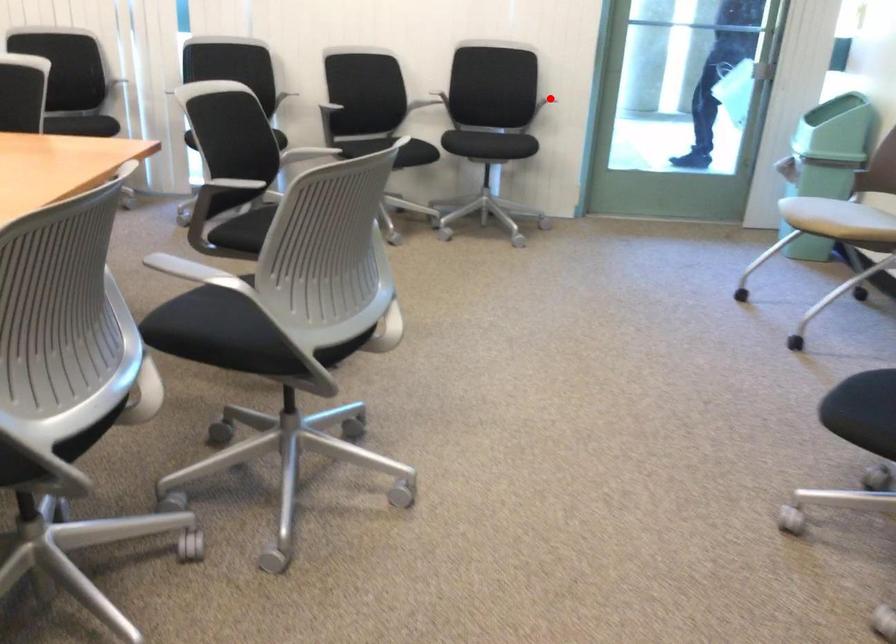
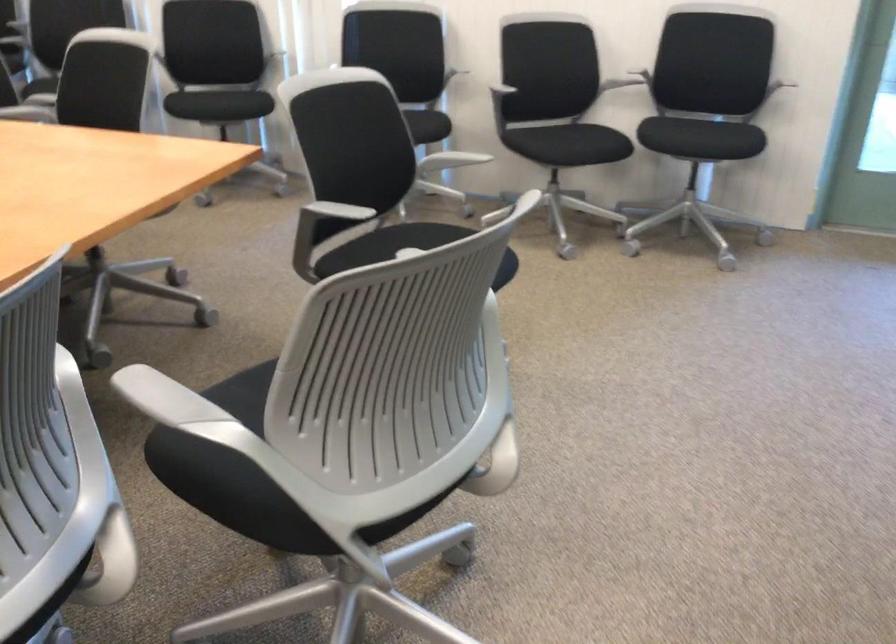
Question: I am providing you with two images of the same scene from different viewpoints. A red point is shown in image1. For the corresponding object point in image2, is it positioned nearer or farther from the camera?

Choices:
 (A) Nearer
 (B) Farther

Answer: (A)